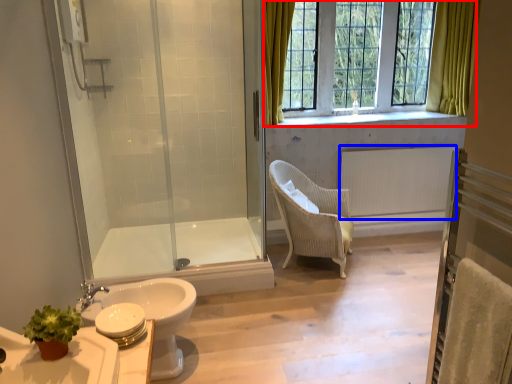
Question: Which of the following is the farthest to the observer, window (highlighted by a red box) or radiator (highlighted by a blue box)?

Choices:
 (A) window
 (B) radiator

Answer: (B)